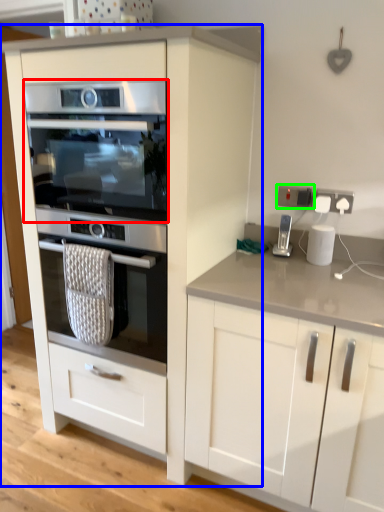
Question: Based on their relative distances, which object is nearer to oven (highlighted by a red box)? Choose from cabinetry (highlighted by a blue box) and electric outlet (highlighted by a green box).

Choices:
 (A) cabinetry
 (B) electric outlet

Answer: (A)